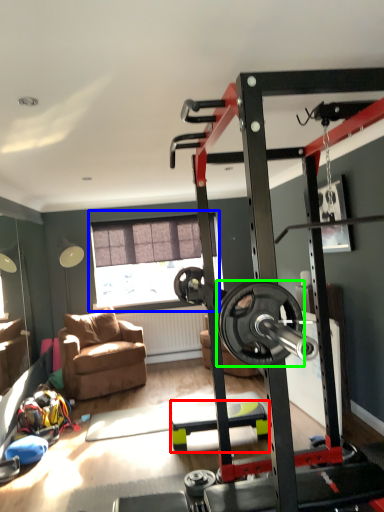
Question: Considering the real-world distances, which object is closest to furniture (highlighted by a red box)? window (highlighted by a blue box) or wheel (highlighted by a green box).

Choices:
 (A) window
 (B) wheel

Answer: (A)